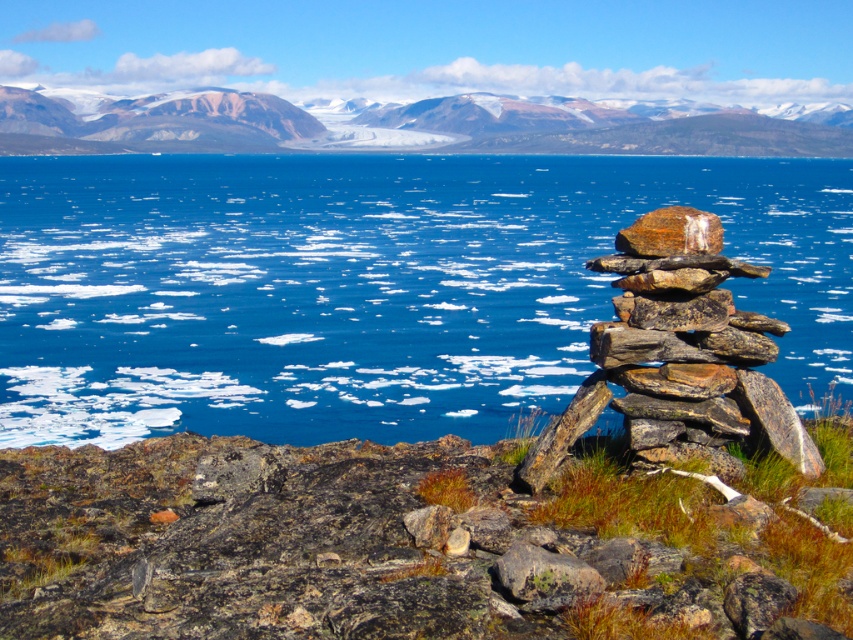
Question: Which of the following is the closest to the observer?

Choices:
 (A) rugged granite mountain at upper center
 (B) rusty metallic rock at lower center
 (C) blue water at center

Answer: (B)

Question: Where is rusty rock at lower right located in relation to rusty metallic rock at center in the image?

Choices:
 (A) below
 (B) above

Answer: (A)

Question: Which point appears farthest from the camera in this image?

Choices:
 (A) (706, 246)
 (B) (422, 118)
 (C) (517, 566)

Answer: (B)

Question: In this image, where is rusty metallic rock at lower center located relative to rusty metallic rock at center?

Choices:
 (A) left
 (B) right

Answer: (A)

Question: Observing the image, what is the correct spatial positioning of blue water at center in reference to rusty metallic rock at lower center?

Choices:
 (A) right
 (B) left

Answer: (A)

Question: Which point is closer to the camera?

Choices:
 (A) rusty rock at lower right
 (B) blue water at center
 (C) rugged granite mountain at upper center

Answer: (A)